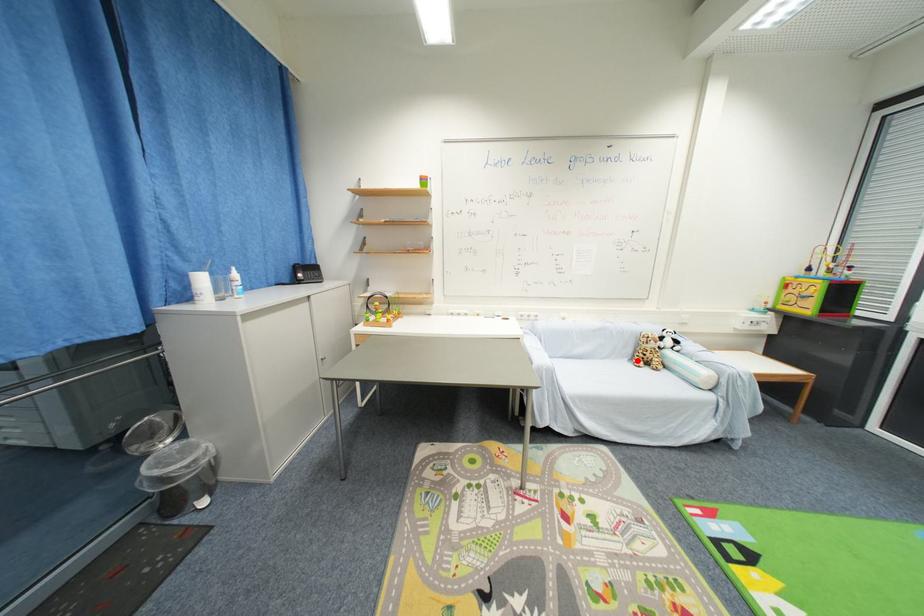
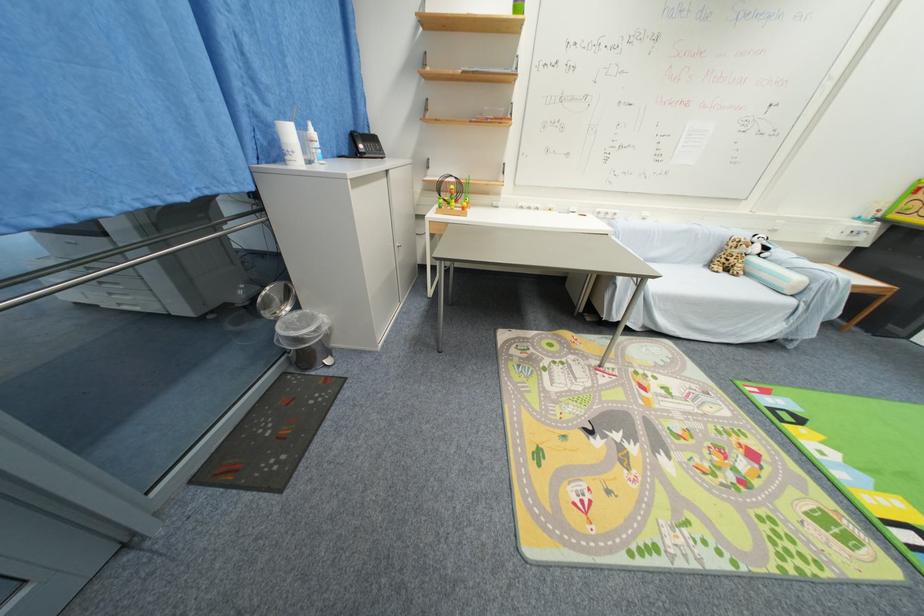
Question: I am providing you with two images of the same scene from different viewpoints. A red point is marked on the first image. At the location where the point appears in image 1, is it still visible in image 2?

Choices:
 (A) Yes
 (B) No

Answer: (A)